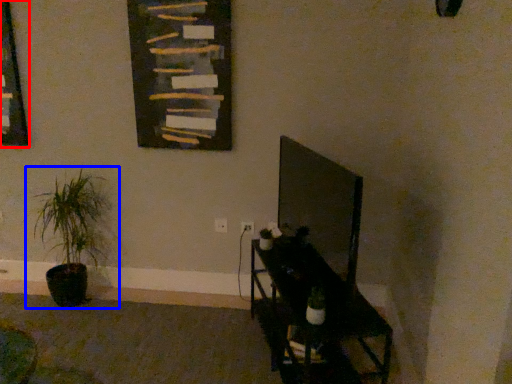
Question: Which object appears farthest to the camera in this image, picture frame (highlighted by a red box) or houseplant (highlighted by a blue box)?

Choices:
 (A) picture frame
 (B) houseplant

Answer: (A)